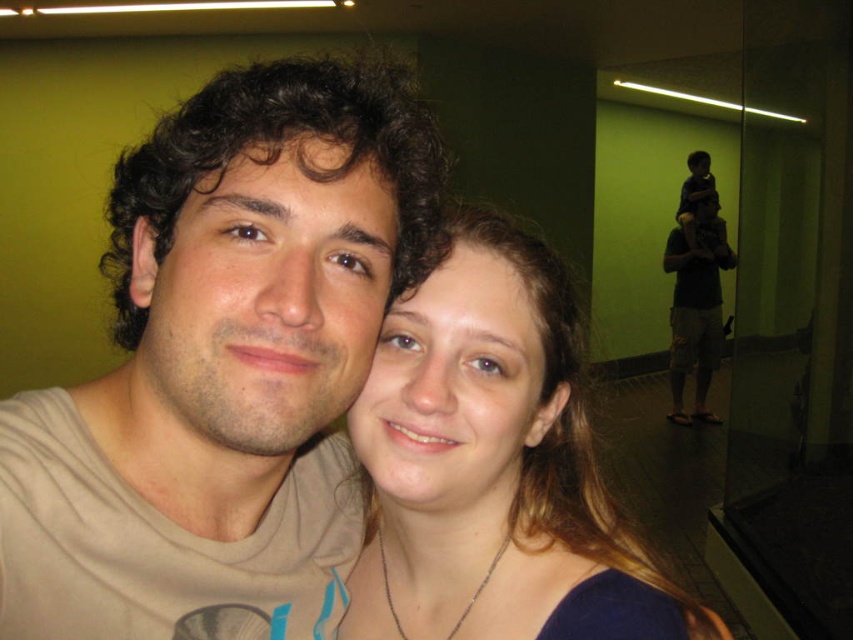
Is point (187, 124) positioned in front of point (543, 422)?

Yes, it is in front of point (543, 422).

In order to click on matte beige shirt at center in this screenshot , I will do `click(224, 365)`.

This screenshot has width=853, height=640. Identify the location of matte beige shirt at center. (224, 365).